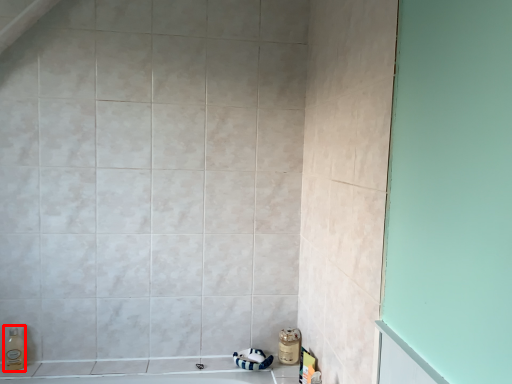
Question: From the image's perspective, what is the correct spatial positioning of soap dispenser (annotated by the red box) in reference to toiletry?

Choices:
 (A) above
 (B) below

Answer: (A)